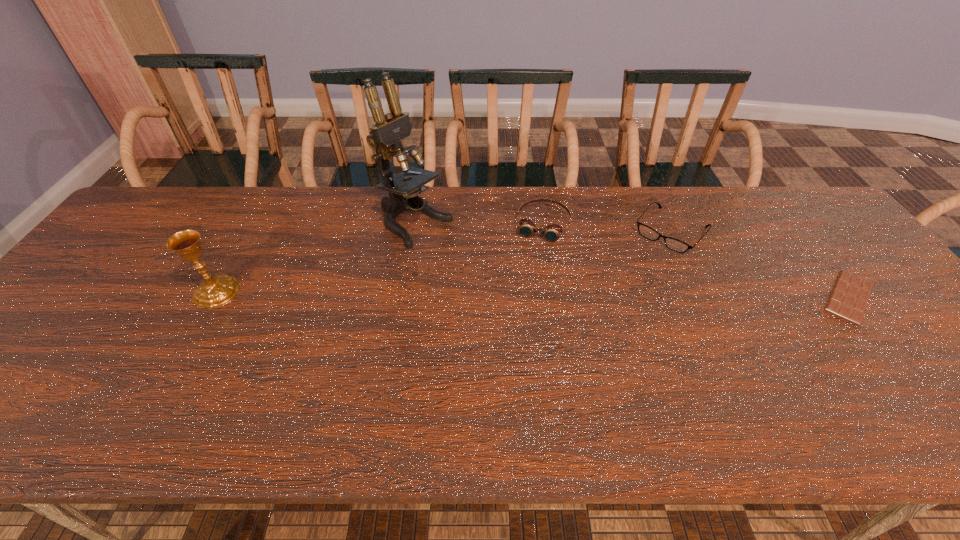
Find the location of a particular element. The height and width of the screenshot is (540, 960). vacant space at the near right corner of the desktop is located at coordinates (941, 376).

Where is `free area in between the goggles and the shortest object`? This screenshot has width=960, height=540. free area in between the goggles and the shortest object is located at coordinates (696, 260).

This screenshot has height=540, width=960. I want to click on free space between the fourth tallest object and the chalice, so click(444, 261).

The width and height of the screenshot is (960, 540). In order to click on vacant space that is in between the leftmost object and the rightmost object in this screenshot , I will do `click(533, 294)`.

I want to click on vacant region between the third object from left to right and the second shortest object, so click(607, 228).

Locate an element on the screen. free spot between the spectacles and the tallest object is located at coordinates (542, 228).

At what (x,y) coordinates should I click in order to perform the action: click on vacant space that's between the goggles and the leftmost object. Please return your answer as a coordinate pair (x, y). Looking at the image, I should click on (380, 258).

Identify the location of vacant area that lies between the chalice and the microscope. (316, 258).

Locate an element on the screen. empty location between the fourth tallest object and the third shortest object is located at coordinates (607, 228).

Find the location of a particular element. Image resolution: width=960 pixels, height=540 pixels. vacant space that is in between the spectacles and the tallest object is located at coordinates coord(542,228).